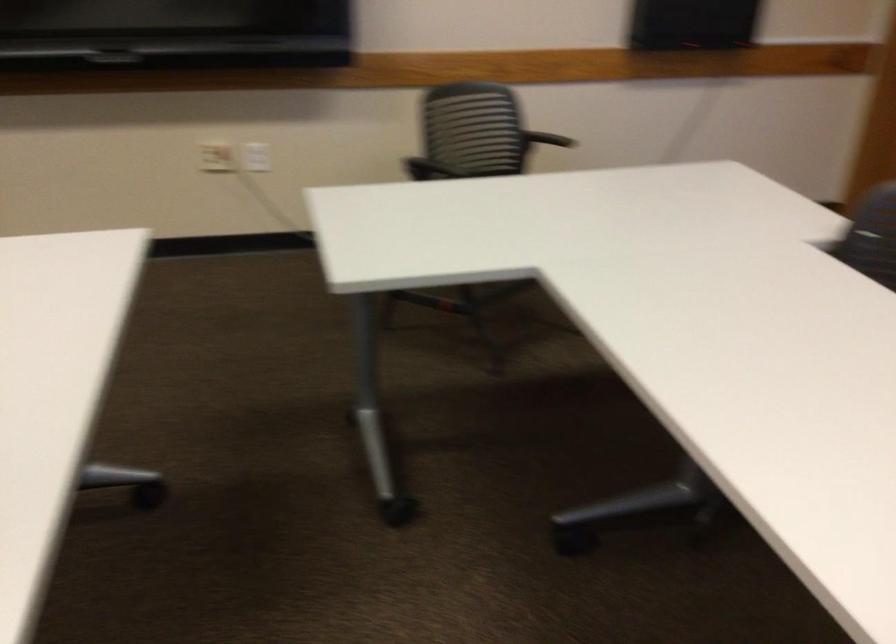
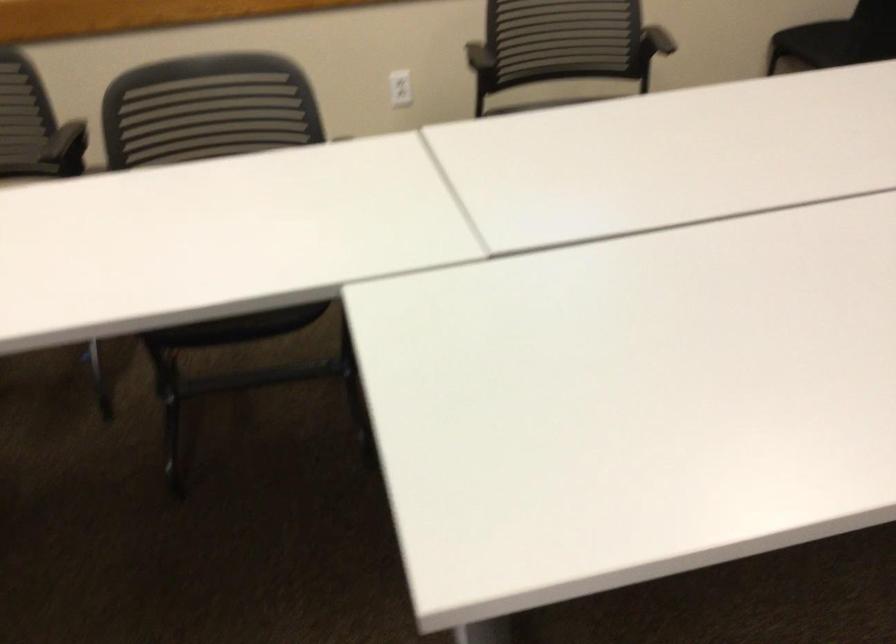
How did the camera likely rotate?

The camera's rotation is toward left-down.